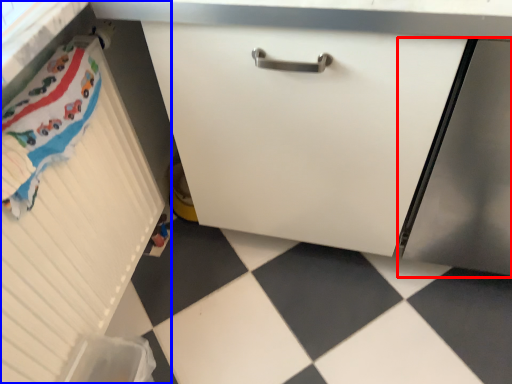
Question: Which of the following is the farthest to the observer, screen door (highlighted by a red box) or cabinetry (highlighted by a blue box)?

Choices:
 (A) screen door
 (B) cabinetry

Answer: (A)